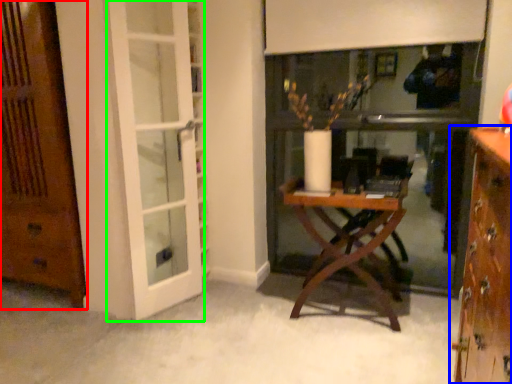
Question: Estimate the real-world distances between objects in this image. Which object is farther from door (highlighted by a red box), cabinetry (highlighted by a blue box) or screen door (highlighted by a green box)?

Choices:
 (A) cabinetry
 (B) screen door

Answer: (A)